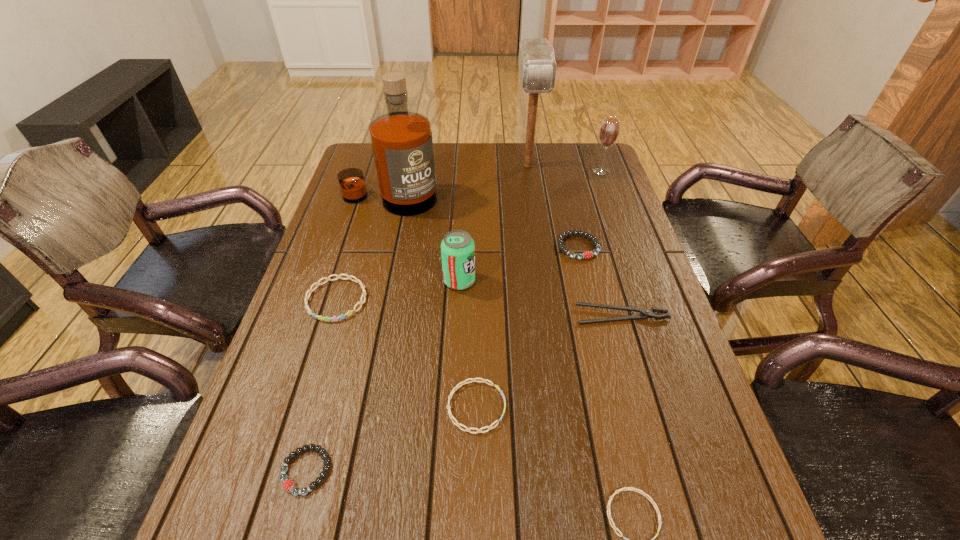
In order to click on free space located on the back of the tongs in this screenshot , I will do `click(615, 292)`.

Locate an element on the screen. vacant space located 0.110m on the surface of the second smallest blue bracelet showing star-shaped elements is located at coordinates (560, 407).

Identify the location of free space located 0.150m on the right of the smaller black bracelet. Image resolution: width=960 pixels, height=540 pixels. (414, 470).

At what (x,y) coordinates should I click in order to perform the action: click on mallet present at the far edge. Please return your answer as a coordinate pair (x, y). The width and height of the screenshot is (960, 540). Looking at the image, I should click on (537, 67).

Where is `wineglass located at the far edge`? This screenshot has width=960, height=540. wineglass located at the far edge is located at coordinates (609, 130).

Locate an element on the screen. Image resolution: width=960 pixels, height=540 pixels. liquor present at the left edge is located at coordinates (402, 145).

Image resolution: width=960 pixels, height=540 pixels. Find the location of `wineglass positioned at the right edge`. wineglass positioned at the right edge is located at coordinates [x=609, y=130].

At what (x,y) coordinates should I click in order to perform the action: click on bracelet located in the right edge section of the desktop. Please return your answer as a coordinate pair (x, y). This screenshot has width=960, height=540. Looking at the image, I should click on (587, 254).

Find the location of `tongs present at the right edge`. tongs present at the right edge is located at coordinates (645, 313).

Identify the location of object that is at the far right corner. This screenshot has width=960, height=540. (609, 130).